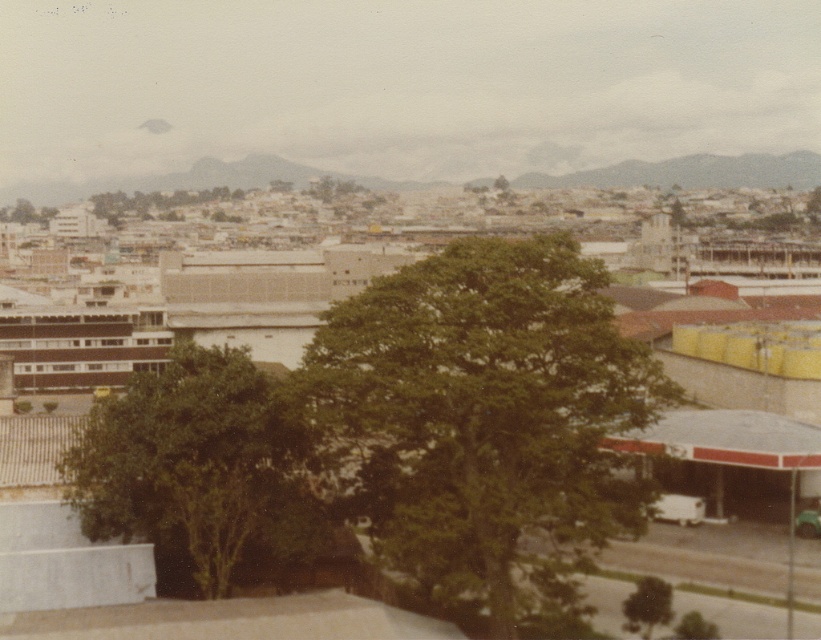
In the scene shown: You are standing at the base of the trees in the cityscape image. You notice two points marked in the scene. The first point is at coordinates point (152, 532) and the second is at point (681, 632). Which of these points is closer to you?

Point (152, 532) is closer to you because it is in front of point (681, 632).